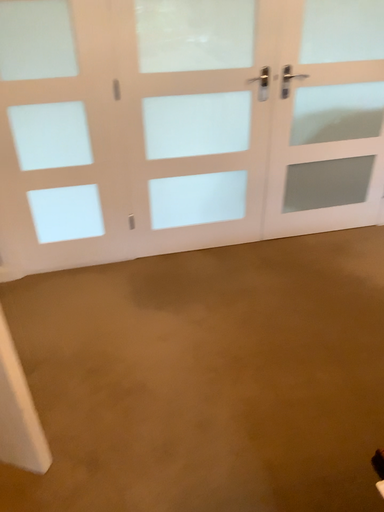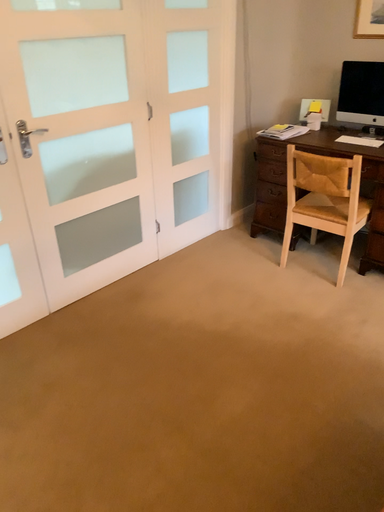
Question: Which way did the camera rotate in the video?

Choices:
 (A) rotated right
 (B) rotated left

Answer: (A)